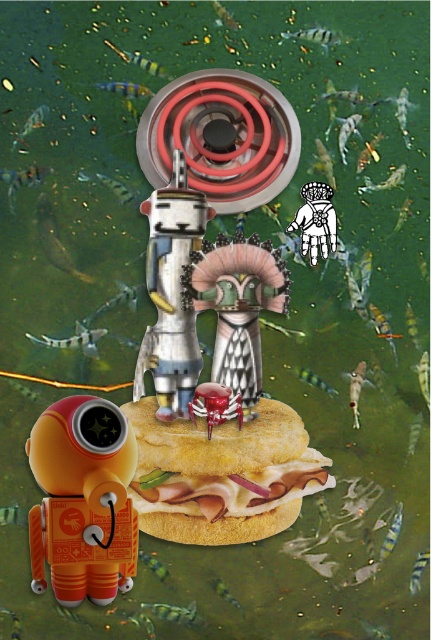
Question: Considering the real-world distances, which object is closest to the golden crispy bun at center?

Choices:
 (A) metallic silver helmet at center
 (B) metallic silver robot at center
 (C) orange matte robot at lower left

Answer: (C)

Question: Estimate the real-world distances between objects in this image. Which object is farther from the orange matte robot at lower left?

Choices:
 (A) white paper hand at upper center
 (B) metallic silver robot at center
 (C) metallic silver helmet at center

Answer: (A)

Question: Considering the relative positions of golden crispy bun at center and metallic silver robot at center in the image provided, where is golden crispy bun at center located with respect to metallic silver robot at center?

Choices:
 (A) below
 (B) above

Answer: (A)

Question: Can you confirm if metallic silver robot at center is positioned below metallic silver helmet at center?

Choices:
 (A) yes
 (B) no

Answer: (B)

Question: Among these points, which one is farthest from the camera?

Choices:
 (A) (324, 253)
 (B) (162, 285)
 (C) (75, 408)

Answer: (A)

Question: Observing the image, what is the correct spatial positioning of orange matte robot at lower left in reference to white paper hand at upper center?

Choices:
 (A) right
 (B) left

Answer: (B)